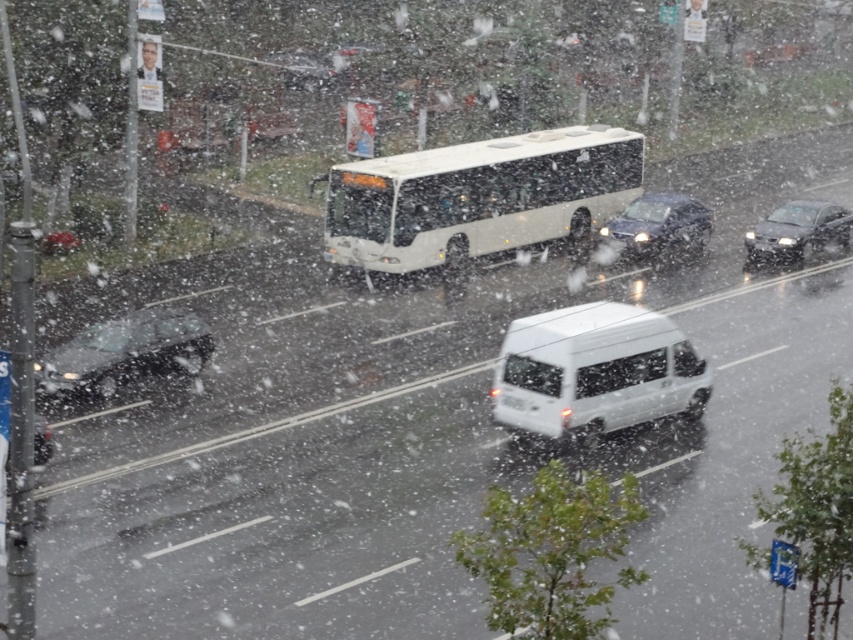
Question: Which object is farther from the camera taking this photo?

Choices:
 (A) shiny black sedan at right
 (B) glossy black car at lower left

Answer: (A)

Question: Observing the image, what is the correct spatial positioning of white matte van at center in reference to shiny black sedan at right?

Choices:
 (A) left
 (B) right

Answer: (A)

Question: Considering the real-world distances, which object is closest to the white matte van at center?

Choices:
 (A) sleek black sedan at center
 (B) shiny black sedan at right

Answer: (B)

Question: Does white matte bus at center come in front of sleek black sedan at center?

Choices:
 (A) yes
 (B) no

Answer: (A)

Question: Can you confirm if white matte bus at center is bigger than shiny black sedan at right?

Choices:
 (A) no
 (B) yes

Answer: (B)

Question: Which point is farther to the camera?

Choices:
 (A) (706, 212)
 (B) (167, 314)
 (C) (548, 161)
 (D) (782, 227)

Answer: (A)